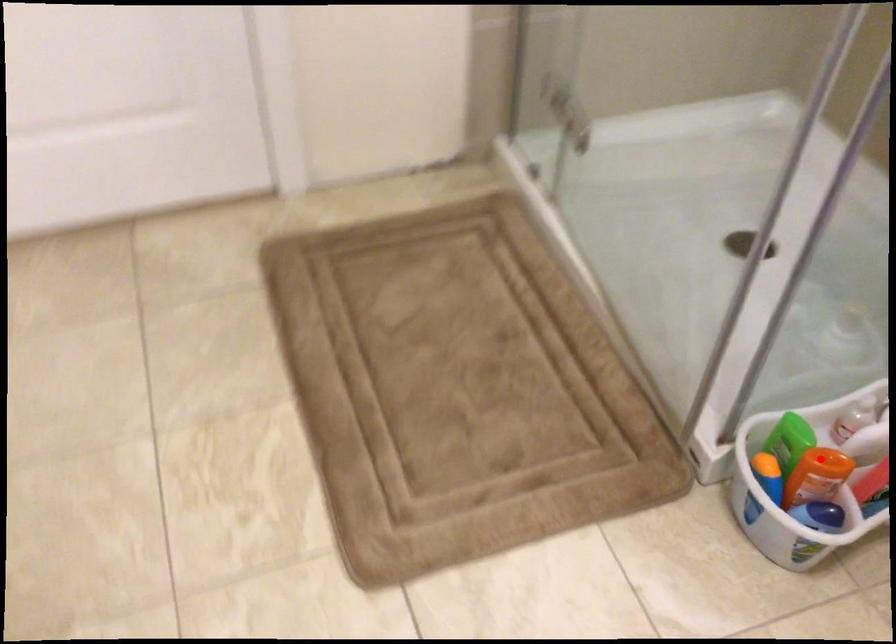
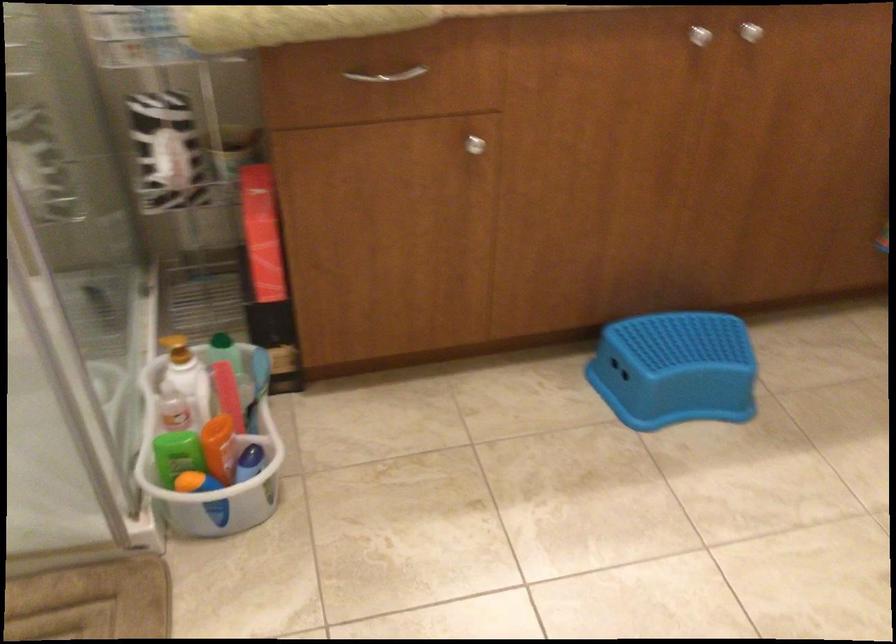
Question: I am providing you with two images of the same scene from different viewpoints. A red point is shown in image1. For the corresponding object point in image2, is it positioned nearer or farther from the camera?

Choices:
 (A) Nearer
 (B) Farther

Answer: (B)